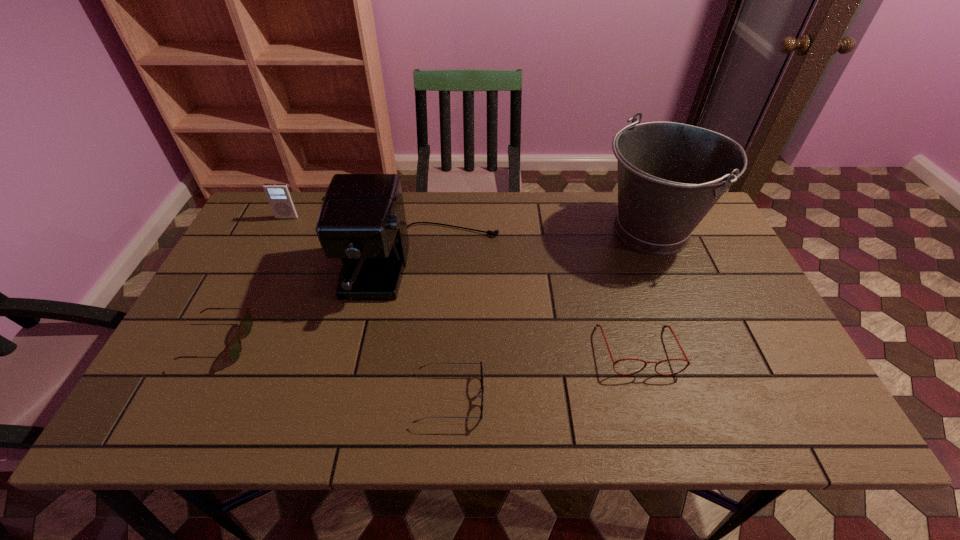
I want to click on object situated at the far left corner, so click(x=279, y=196).

Identify the location of object located at the far right corner. This screenshot has width=960, height=540. (670, 175).

Locate an element on the screen. This screenshot has height=540, width=960. free space at the far edge is located at coordinates point(523,206).

The image size is (960, 540). In the image, there is a desktop. Find the location of `vacant space at the near edge`. vacant space at the near edge is located at coordinates (316, 407).

Where is `free space at the left edge`? The width and height of the screenshot is (960, 540). free space at the left edge is located at coordinates (262, 261).

At what (x,y) coordinates should I click in order to perform the action: click on blank area at the right edge. Please return your answer as a coordinate pair (x, y). Looking at the image, I should click on 710,327.

At what (x,y) coordinates should I click in order to perform the action: click on free space at the far left corner of the desktop. Please return your answer as a coordinate pair (x, y). Looking at the image, I should click on (291, 221).

Locate an element on the screen. This screenshot has height=540, width=960. vacant space at the near left corner is located at coordinates (197, 428).

At what (x,y) coordinates should I click in order to perform the action: click on free region at the far right corner of the desktop. Please return your answer as a coordinate pair (x, y). Looking at the image, I should click on (699, 226).

You are a GUI agent. You are given a task and a screenshot of the screen. Output one action in this format:
    pyautogui.click(x=<x>, y=<y>)
    Task: Click on the vacant area between the second spectacles from right to left and the coffee maker
    The height and width of the screenshot is (540, 960).
    Given the screenshot: What is the action you would take?
    pyautogui.click(x=436, y=332)